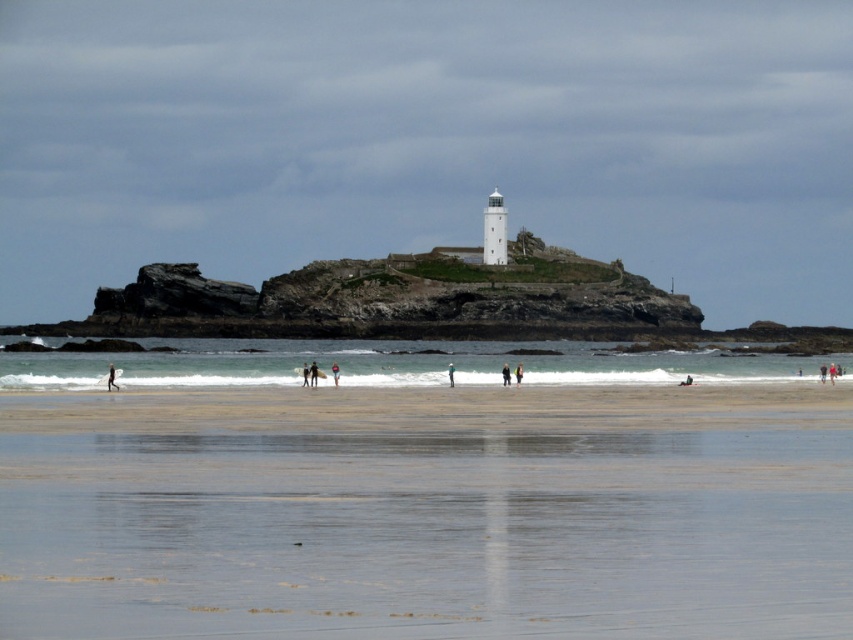
Question: Which point is closer to the camera?

Choices:
 (A) (334, 364)
 (B) (109, 372)
 (C) (527, 577)

Answer: (C)

Question: From the image, what is the correct spatial relationship of smooth sand at lower center in relation to light brown surfboard at center?

Choices:
 (A) above
 (B) below

Answer: (B)

Question: Estimate the real-world distances between objects in this image. Which object is closer to the smooth sand at lower center?

Choices:
 (A) smooth skin surfer at center
 (B) dark blue wetsuit at center
 (C) dark brown leather jacket at center

Answer: (C)

Question: Does dark blue wetsuit at center appear on the right side of red fabric person at center?

Choices:
 (A) no
 (B) yes

Answer: (A)

Question: Is smooth skin surfer at center above red fabric person at center?

Choices:
 (A) no
 (B) yes

Answer: (B)

Question: Considering the real-world distances, which object is closest to the light brown sand at center?

Choices:
 (A) smooth sand at lower center
 (B) dark blue fabric surfboard at center

Answer: (B)